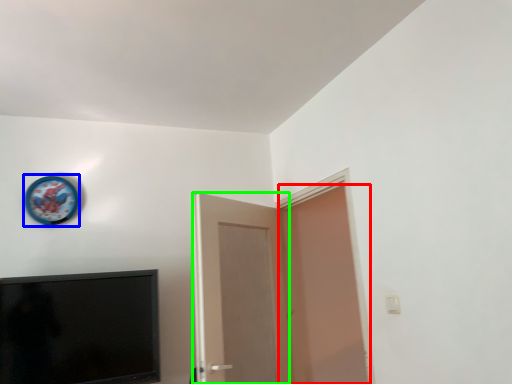
Question: Which is nearer to the door (highlighted by a red box)? clock (highlighted by a blue box) or door (highlighted by a green box).

Choices:
 (A) clock
 (B) door

Answer: (B)